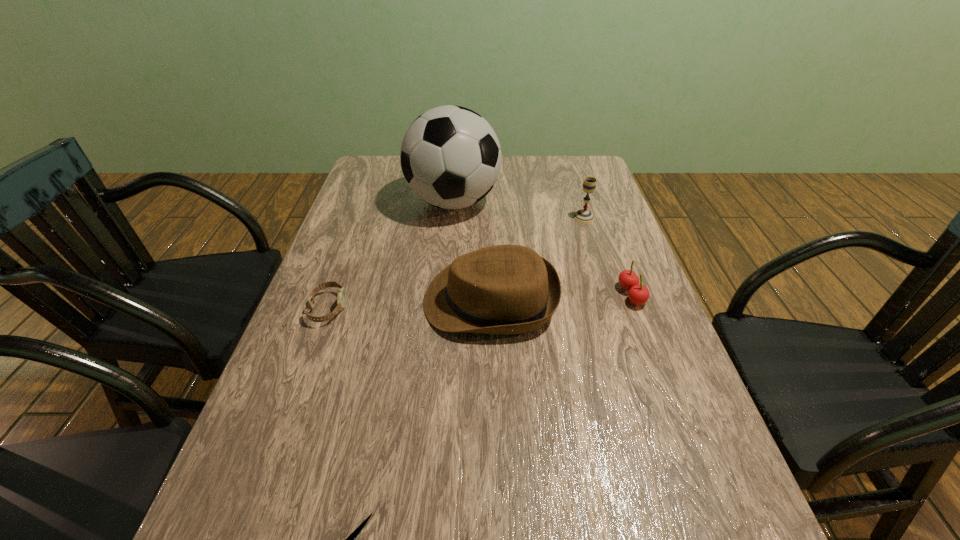
You are a GUI agent. You are given a task and a screenshot of the screen. Output one action in this format:
    pyautogui.click(x=<x>, y=<y>)
    Task: Click on the soccer ball
    This screenshot has width=960, height=540.
    Given the screenshot: What is the action you would take?
    pyautogui.click(x=450, y=156)

At what (x,y) coordinates should I click in order to perform the action: click on chalice. Please return your answer as a coordinate pair (x, y). The image size is (960, 540). Looking at the image, I should click on (585, 216).

Locate an element on the screen. fedora is located at coordinates (505, 289).

At what (x,y) coordinates should I click in order to perform the action: click on cherry. Please return your answer as a coordinate pair (x, y). The height and width of the screenshot is (540, 960). Looking at the image, I should click on (638, 294).

Where is `the leftmost object`? This screenshot has width=960, height=540. the leftmost object is located at coordinates (341, 297).

This screenshot has width=960, height=540. What are the coordinates of `watch` in the screenshot? It's located at [341, 297].

Where is `free space located 0.070m on the front of the tallest object`? The width and height of the screenshot is (960, 540). free space located 0.070m on the front of the tallest object is located at coordinates (449, 244).

In order to click on vacant space located on the front of the chalice in this screenshot , I will do `click(613, 309)`.

Image resolution: width=960 pixels, height=540 pixels. I want to click on free space located on the front-facing side of the fedora, so click(x=386, y=300).

Locate an element on the screen. Image resolution: width=960 pixels, height=540 pixels. blank space located on the front-facing side of the fedora is located at coordinates (366, 300).